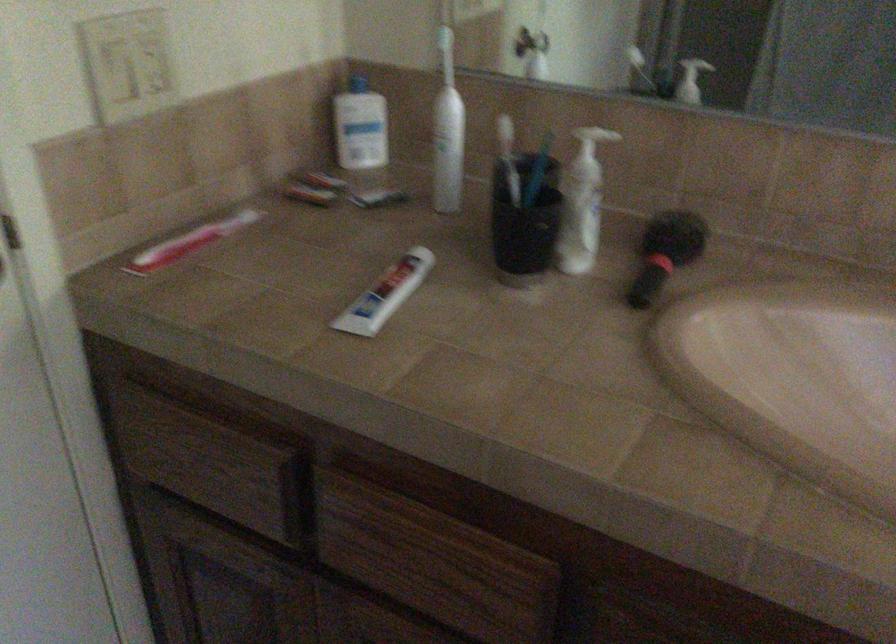
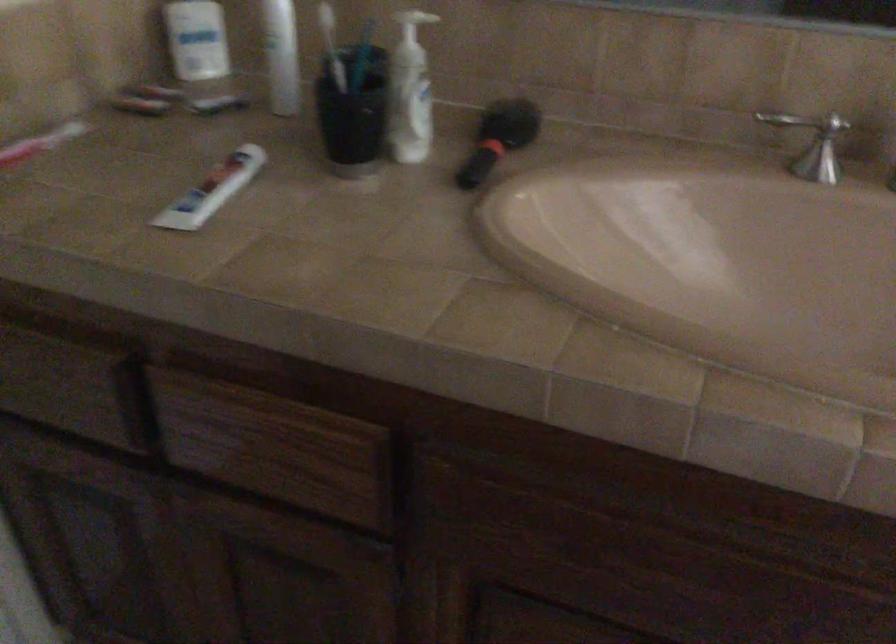
Where in the second image is the point corresponding to point 221,228 from the first image?

(42, 145)